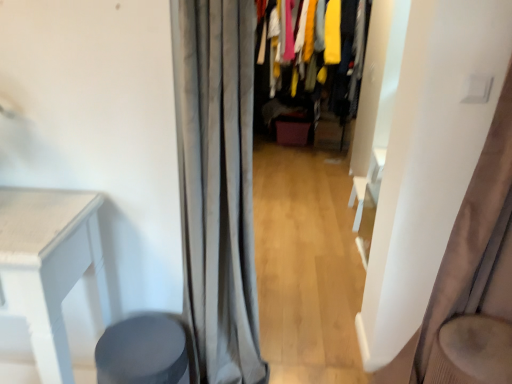
At what (x,y) coordinates should I click in order to perform the action: click on vacant space underneath velvet fabric clothes at center (from a real-world perspective). Please return your answer as a coordinate pair (x, y). This screenshot has height=384, width=512. Looking at the image, I should click on (300, 160).